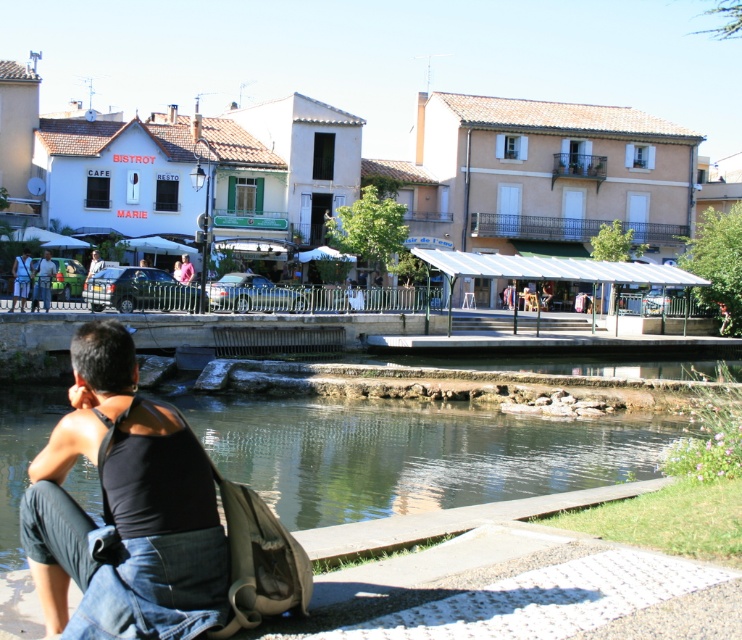
Question: From the image, what is the correct spatial relationship of clear water at lower center in relation to matte black shirt at left?

Choices:
 (A) left
 (B) right

Answer: (B)

Question: Does clear water at lower center lie behind matte black shirt at left?

Choices:
 (A) no
 (B) yes

Answer: (A)

Question: Which point appears farthest from the camera in this image?

Choices:
 (A) (122, 364)
 (B) (24, 259)
 (C) (27, 397)
 (D) (45, 296)

Answer: (B)

Question: Which point is closer to the camera?

Choices:
 (A) black cotton tank top at lower left
 (B) clear water at lower center
 (C) matte black shirt at lower left
 (D) matte black shirt at left

Answer: (A)

Question: Which point is closer to the camera taking this photo?

Choices:
 (A) (27, 276)
 (B) (116, 458)

Answer: (B)

Question: Does clear water at lower center have a greater width compared to matte black shirt at left?

Choices:
 (A) yes
 (B) no

Answer: (A)